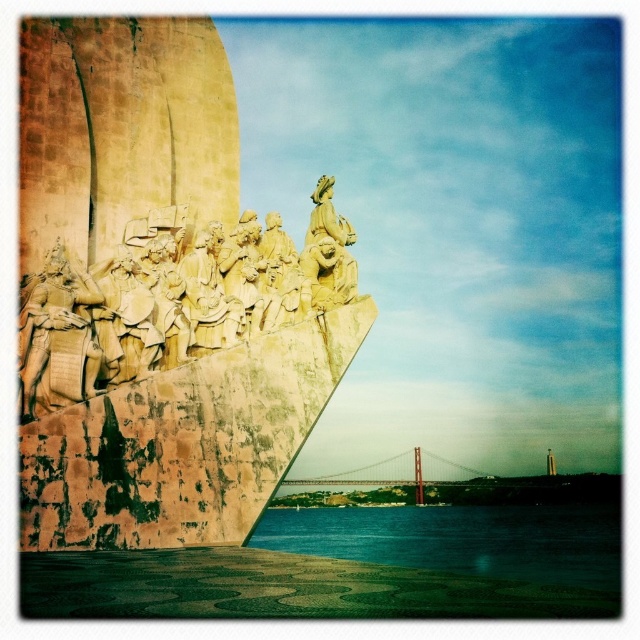
You are standing at the waterfront and want to take a photo of the golden stone monument at left. If your camera has a maximum zoom range of 100 feet, will you be able to capture the entire monument in the photo without moving closer?

The golden stone monument at left is 163.21 feet away from the viewer. Since the camera can only zoom up to 100 feet, you will not be able to capture the entire monument without moving closer.

You are a tourist standing at the center of the bridge. You want to take a photo of the golden stone monument at left. Which direction should you face to capture the monument in your shot?

Since the golden stone monument at left is located at coordinates point (157, 296), you should face to the left direction to capture it in your photo.

You are standing at the waterfront and see the blue water at lower center and the golden metallic suspension bridge at center. Which object is positioned to the right side from your viewpoint?

The blue water at lower center is to the right of the golden metallic suspension bridge at center, so the blue water at lower center is positioned to the right side from your viewpoint.